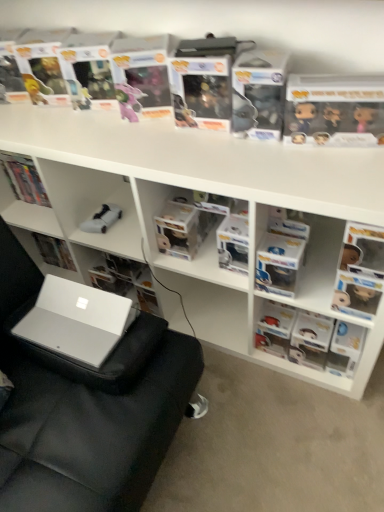
The width and height of the screenshot is (384, 512). Find the location of `free spot to the left of clear plastic book at upper center, the 2th paperback book when ordered from right to left`. free spot to the left of clear plastic book at upper center, the 2th paperback book when ordered from right to left is located at coordinates (151, 136).